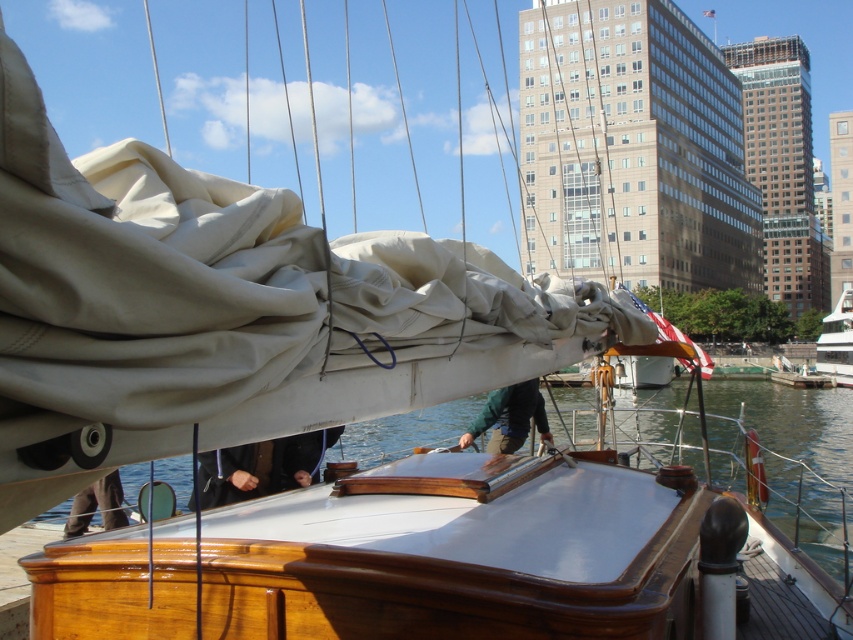
Question: Is wooden boat at center to the left of white glossy yacht at right from the viewer's perspective?

Choices:
 (A) no
 (B) yes

Answer: (B)

Question: Among these objects, which one is nearest to the camera?

Choices:
 (A) dark blue fabric at center
 (B) green fabric jacket at center
 (C) wooden boat at center
 (D) dark gray fabric at lower center

Answer: (C)

Question: Can you confirm if green fabric jacket at center is bigger than dark gray fabric at lower center?

Choices:
 (A) yes
 (B) no

Answer: (A)

Question: Is dark blue fabric at center behind dark gray fabric at lower center?

Choices:
 (A) yes
 (B) no

Answer: (B)

Question: Which of the following is the farthest from the observer?

Choices:
 (A) (726, 401)
 (B) (834, 374)

Answer: (B)

Question: Among these points, which one is nearest to the camera?

Choices:
 (A) (483, 417)
 (B) (113, 500)
 (C) (828, 353)
 (D) (225, 472)

Answer: (D)